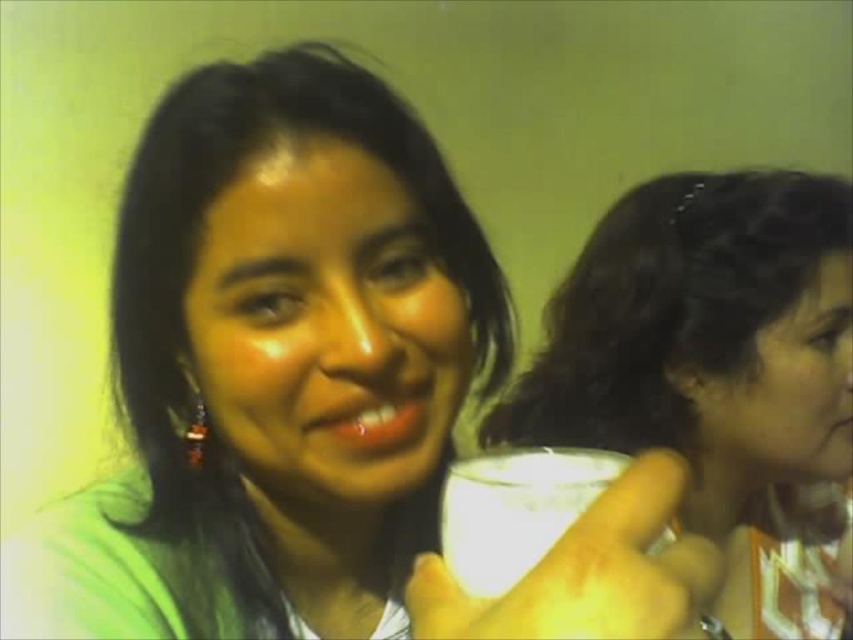
Question: Does matte white cup at right have a greater width compared to white matte cup at center?

Choices:
 (A) yes
 (B) no

Answer: (A)

Question: Where is matte white cup at right located in relation to white matte cup at center in the image?

Choices:
 (A) left
 (B) right

Answer: (B)

Question: Which point is closer to the camera?

Choices:
 (A) (471, 612)
 (B) (614, 221)

Answer: (A)

Question: Can you confirm if matte white cup at right is wider than white matte cup at center?

Choices:
 (A) yes
 (B) no

Answer: (A)